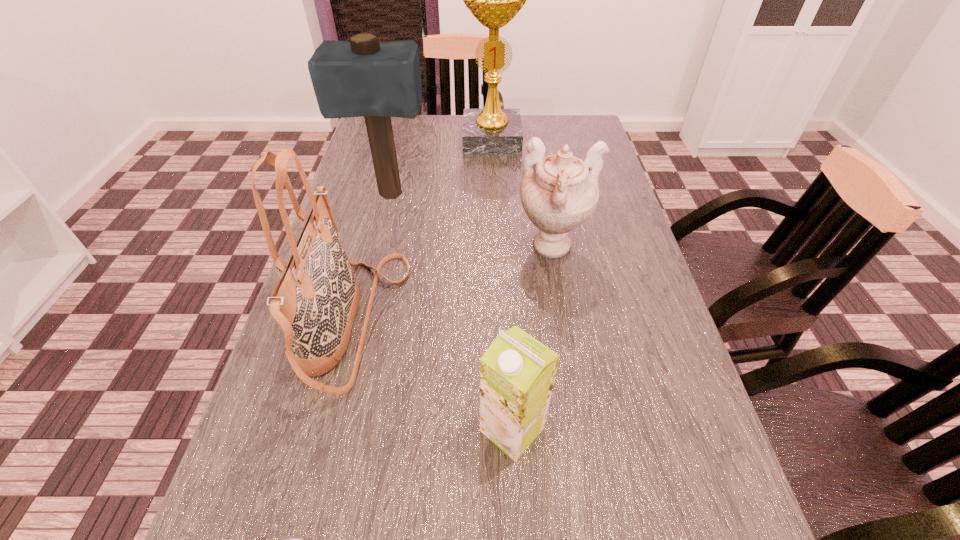
Identify the location of empty location between the award and the fifth nearest object. point(441,167).

Locate an element on the screen. The image size is (960, 540). free area in between the soya milk and the farthest object is located at coordinates (502, 285).

The image size is (960, 540). What are the coordinates of `empty space that is in between the second farthest object and the soya milk` in the screenshot? It's located at (451, 313).

The height and width of the screenshot is (540, 960). In order to click on empty space that is in between the fifth nearest object and the award in this screenshot , I will do `click(441, 167)`.

Identify the location of object that stands as the fourth closest to the handbag. Image resolution: width=960 pixels, height=540 pixels. point(559,192).

Locate which object is the third closest to the mallet. Please provide its 2D coordinates. Your answer should be formatted as a tuple, i.e. [(x, y)], where the tuple contains the x and y coordinates of a point satisfying the conditions above.

[(559, 192)]

Locate an element on the screen. The height and width of the screenshot is (540, 960). free location that satisfies the following two spatial constraints: 1. on the front-facing side of the handbag; 2. on the back side of the soya milk is located at coordinates (327, 429).

This screenshot has height=540, width=960. What are the coordinates of `vacant region that satisfies the following two spatial constraints: 1. on the front-facing side of the farthest object; 2. on the left side of the urn` in the screenshot? It's located at (496, 248).

The width and height of the screenshot is (960, 540). In order to click on blank area in the image that satisfies the following two spatial constraints: 1. on the front-facing side of the handbag; 2. on the right side of the soya milk in this screenshot , I will do click(327, 429).

Where is `vacant area that satisfies the following two spatial constraints: 1. on the front-facing side of the soya milk; 2. on the right side of the farthest object`? vacant area that satisfies the following two spatial constraints: 1. on the front-facing side of the soya milk; 2. on the right side of the farthest object is located at coordinates (503, 429).